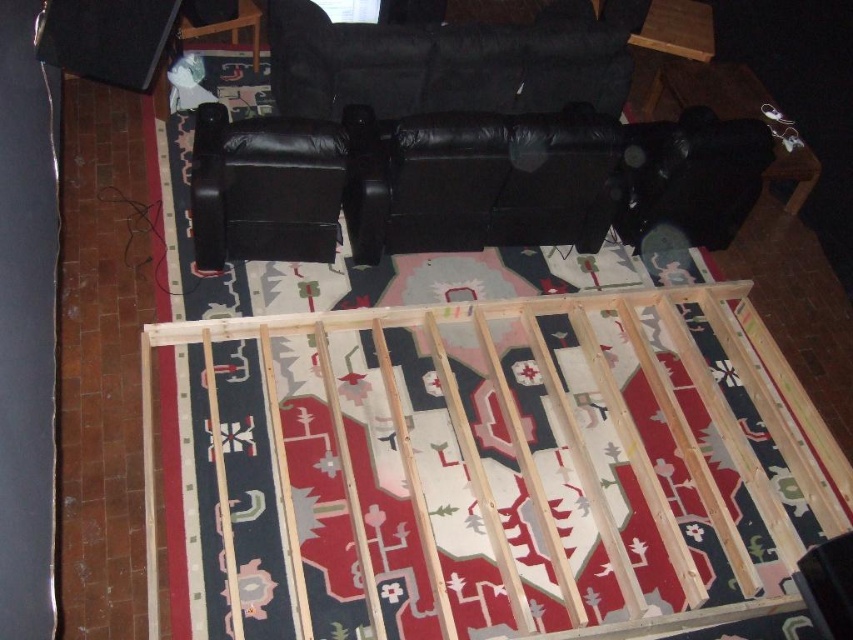
Does black leather couch at center appear under black leather couch at upper center?

Actually, black leather couch at center is above black leather couch at upper center.

Image resolution: width=853 pixels, height=640 pixels. In order to click on black leather couch at center in this screenshot , I will do `click(444, 64)`.

The width and height of the screenshot is (853, 640). What do you see at coordinates (444, 64) in the screenshot?
I see `black leather couch at center` at bounding box center [444, 64].

At what (x,y) coordinates should I click in order to perform the action: click on black leather couch at center. Please return your answer as a coordinate pair (x, y). This screenshot has height=640, width=853. Looking at the image, I should click on (444, 64).

Who is shorter, black leather couch at center or black leather armchair at upper center?

With less height is black leather armchair at upper center.

Can you confirm if black leather couch at center is bigger than black leather armchair at upper center?

Yes, black leather couch at center is bigger than black leather armchair at upper center.

The image size is (853, 640). What do you see at coordinates (444, 64) in the screenshot? I see `black leather couch at center` at bounding box center [444, 64].

At what (x,y) coordinates should I click in order to perform the action: click on black leather couch at center. Please return your answer as a coordinate pair (x, y). The image size is (853, 640). Looking at the image, I should click on (444, 64).

Is black leather armchair at upper center to the left of black leather couch at upper center from the viewer's perspective?

Correct, you'll find black leather armchair at upper center to the left of black leather couch at upper center.

What do you see at coordinates (264, 188) in the screenshot?
I see `black leather armchair at upper center` at bounding box center [264, 188].

This screenshot has width=853, height=640. I want to click on black leather armchair at upper center, so click(264, 188).